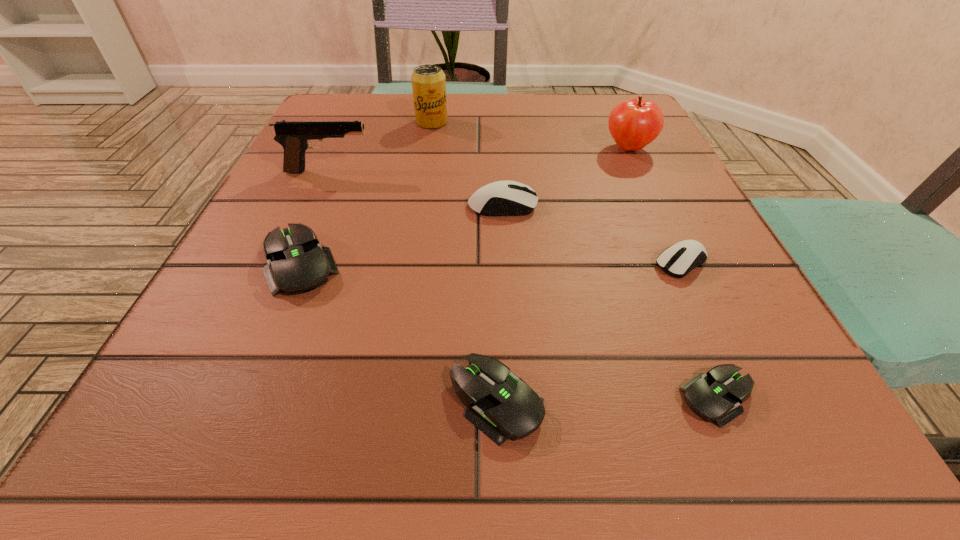
The height and width of the screenshot is (540, 960). What are the coordinates of `the farthest object` in the screenshot? It's located at (428, 81).

Find the location of `beer can`. beer can is located at coordinates (428, 81).

Image resolution: width=960 pixels, height=540 pixels. I want to click on red apple, so click(x=633, y=124).

Locate an element on the screen. The image size is (960, 540). apple is located at coordinates (633, 124).

Find the location of `black pistol`. black pistol is located at coordinates (294, 136).

At what (x,y) coordinates should I click in order to perform the action: click on pistol. Please return your answer as a coordinate pair (x, y). Looking at the image, I should click on (294, 136).

At what (x,y) coordinates should I click in order to perform the action: click on the farther white mouse. Please return your answer as a coordinate pair (x, y). Looking at the image, I should click on (502, 198).

The width and height of the screenshot is (960, 540). What are the coordinates of `the left white mouse` in the screenshot? It's located at (502, 198).

At what (x,y) coordinates should I click in order to perform the action: click on the leftmost gray computer mouse. Please return your answer as a coordinate pair (x, y). Image resolution: width=960 pixels, height=540 pixels. Looking at the image, I should click on (297, 263).

You are a GUI agent. You are given a task and a screenshot of the screen. Output one action in this format:
    pyautogui.click(x=<x>, y=<y>)
    Task: Click on the leftmost computer mouse
    The width and height of the screenshot is (960, 540).
    Given the screenshot: What is the action you would take?
    pyautogui.click(x=297, y=263)